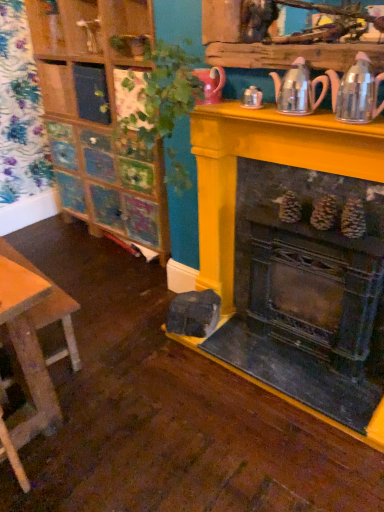
Question: Is metallic silver tea pot at upper right, which is the 2th tea pot in left-to-right order, situated inside green leafy plant at upper center or outside?

Choices:
 (A) inside
 (B) outside

Answer: (B)

Question: In the image, is metallic silver tea pot at upper right, which is the 2th tea pot in left-to-right order, on the left side or the right side of green leafy plant at upper center?

Choices:
 (A) left
 (B) right

Answer: (B)

Question: Which is farther from the metallic silver tea pot at upper right, which is the 2th tea pot in left-to-right order?

Choices:
 (A) green leafy plant at upper center
 (B) shiny metallic teapot at upper right, acting as the 2th tea pot starting from the right
 (C) rustic metal fireplace at center
 (D) wooden stool at lower left

Answer: (D)

Question: Estimate the real-world distances between objects in this image. Which object is closer to the rustic metal fireplace at center?

Choices:
 (A) green leafy plant at upper center
 (B) shiny metallic teapot at upper right, which is the first tea pot in left-to-right order
 (C) metallic silver tea pot at upper right, arranged as the first tea pot when viewed from the right
 (D) wooden stool at lower left

Answer: (C)